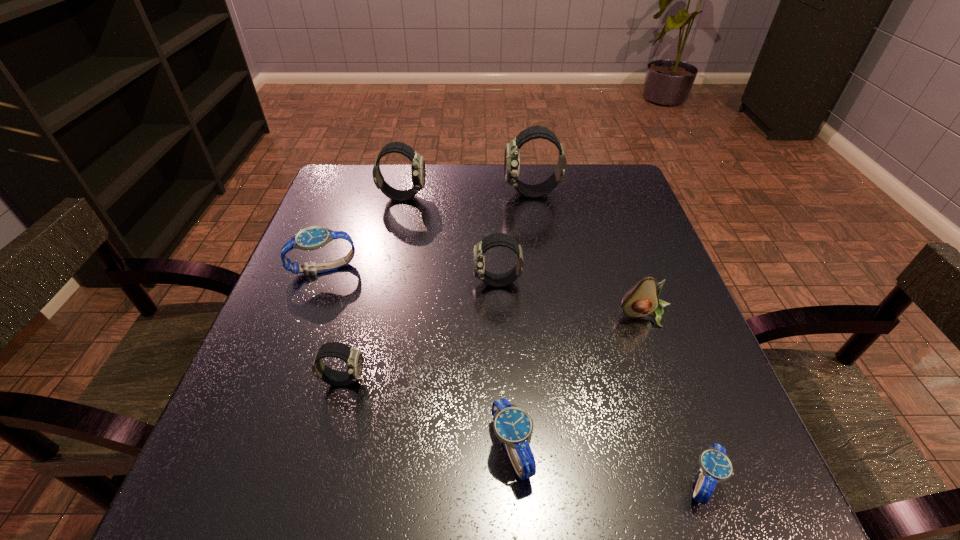
This screenshot has width=960, height=540. Find the location of `free space located 0.070m on the face of the second nearest dark watch`. free space located 0.070m on the face of the second nearest dark watch is located at coordinates (441, 282).

You are a GUI agent. You are given a task and a screenshot of the screen. Output one action in this format:
    pyautogui.click(x=<x>, y=<y>)
    Task: Click on the free spot located 0.050m on the face of the second nearest dark watch
    The image size is (960, 540).
    Given the screenshot: What is the action you would take?
    pyautogui.click(x=450, y=282)

You are a GUI agent. You are given a task and a screenshot of the screen. Output one action in this format:
    pyautogui.click(x=<x>, y=<y>)
    Task: Click on the blank space located 0.340m on the seed side of the fourth nearest object
    This screenshot has width=960, height=540.
    Given the screenshot: What is the action you would take?
    pyautogui.click(x=716, y=519)

At what (x,y) coordinates should I click in order to perform the action: click on vacant space located on the back of the farthest blue watch. Please return your answer as a coordinate pair (x, y). This screenshot has height=540, width=960. Looking at the image, I should click on (362, 167).

Identify the location of free space located on the face of the smallest dark watch. The width and height of the screenshot is (960, 540). (474, 380).

Image resolution: width=960 pixels, height=540 pixels. Identify the location of free space located on the left of the second shortest watch. (309, 449).

Identify the location of vacant space situated on the back of the shortest object. (630, 273).

At what (x,y) coordinates should I click in order to perform the action: click on avocado located in the right edge section of the desktop. Please return your answer as a coordinate pair (x, y). The width and height of the screenshot is (960, 540). Looking at the image, I should click on (641, 300).

Find the location of a particular element. The image size is (960, 540). watch that is at the right edge is located at coordinates (715, 466).

Where is `object at the far left corner`? object at the far left corner is located at coordinates 418,171.